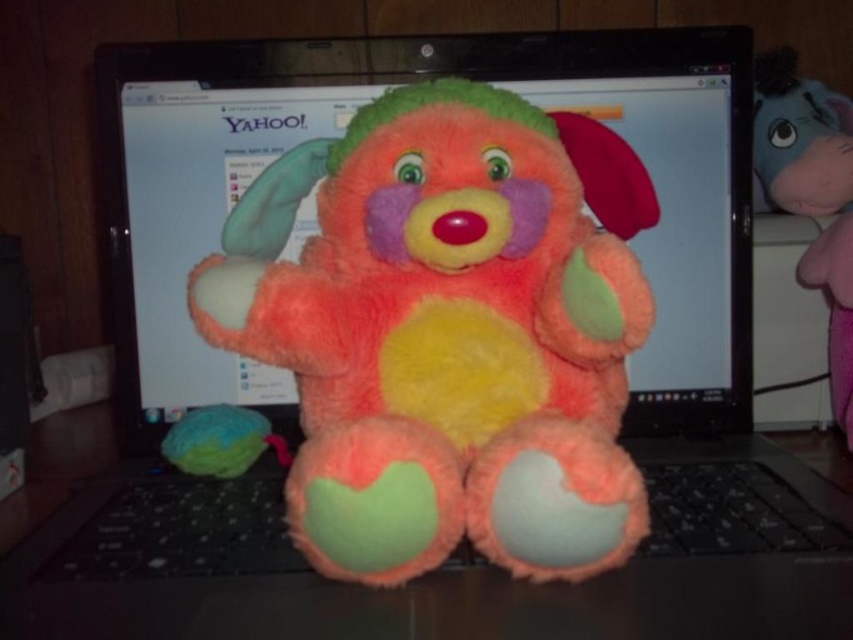
Question: Which is nearer to the fluffy multicolored stuffed animal at center?

Choices:
 (A) matte green plush ball at lower left
 (B) black plastic keyboard at center

Answer: (B)

Question: Which of the following is the farthest from the observer?

Choices:
 (A) (843, 280)
 (B) (788, 504)
 (C) (610, 488)

Answer: (A)

Question: Observing the image, what is the correct spatial positioning of fluffy multicolored stuffed animal at center in reference to black plastic keyboard at center?

Choices:
 (A) below
 (B) above

Answer: (B)

Question: Does fluffy multicolored stuffed animal at center have a larger size compared to pink plush elephant at right?

Choices:
 (A) no
 (B) yes

Answer: (A)

Question: Is black plastic keyboard at center to the left of matte green plush ball at lower left from the viewer's perspective?

Choices:
 (A) no
 (B) yes

Answer: (A)

Question: Estimate the real-world distances between objects in this image. Which object is farther from the fluffy multicolored stuffed animal at center?

Choices:
 (A) matte green plush ball at lower left
 (B) black plastic keyboard at center

Answer: (A)